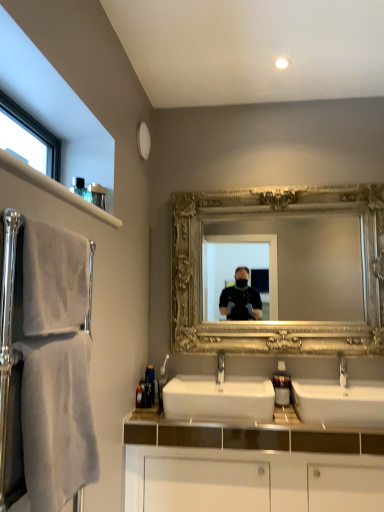
Identify the location of empty space that is ontop of white ceramic sink at center, which appears as the second sink when viewed from the right (from a real-world perspective). (204, 383).